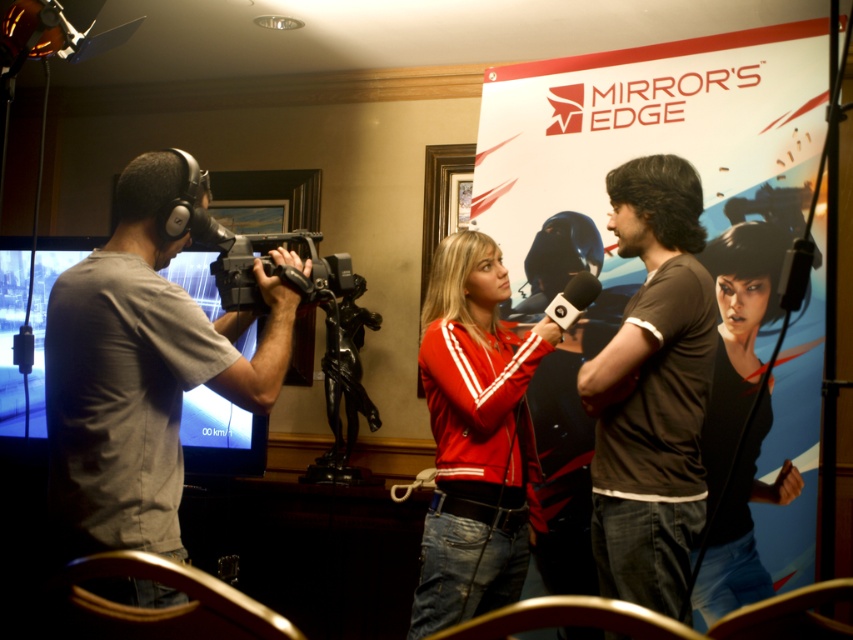
Which is in front, point (677, 228) or point (242, 307)?

Point (242, 307) is in front.

Between point (648, 428) and point (334, 292), which one is positioned behind?

The point (648, 428) is behind.

Identify the location of brown cotton t-shirt at center. The width and height of the screenshot is (853, 640). click(x=653, y=390).

In the scene shown: Is gray fabric shirt at left wider than black matte jacket at center?

Indeed, gray fabric shirt at left has a greater width compared to black matte jacket at center.

Between gray fabric shirt at left and black matte jacket at center, which one appears on the left side from the viewer's perspective?

From the viewer's perspective, gray fabric shirt at left appears more on the left side.

In order to click on gray fabric shirt at left in this screenshot , I will do `click(141, 372)`.

Which is more to the right, red matte jacket at center or black matte jacket at center?

black matte jacket at center

Between red matte jacket at center and black matte jacket at center, which one is positioned higher?

red matte jacket at center is higher up.

At what (x,y) coordinates should I click in order to perform the action: click on red matte jacket at center. Please return your answer as a coordinate pair (x, y). Looking at the image, I should click on (474, 438).

What are the coordinates of `red matte jacket at center` in the screenshot? It's located at (474, 438).